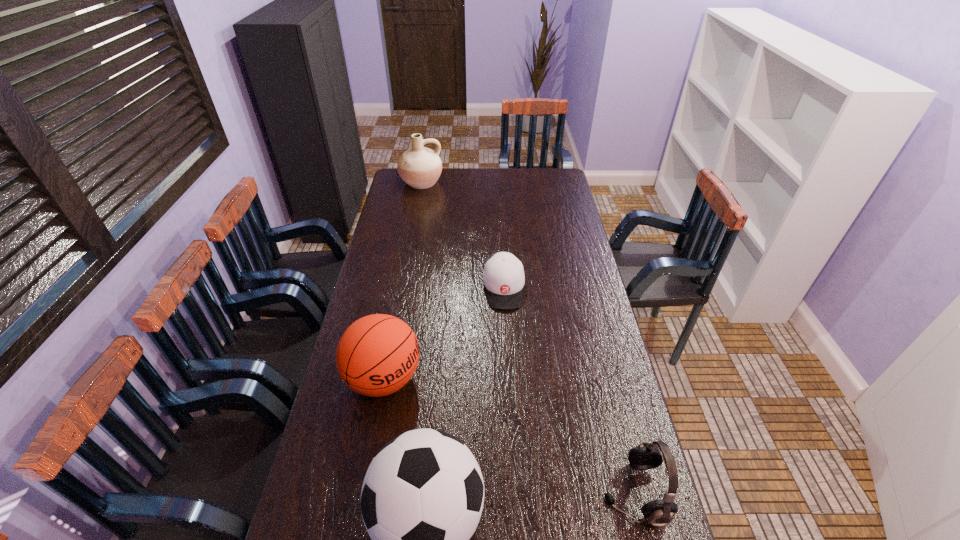
At what (x,y) coordinates should I click in order to perform the action: click on vacant space located 0.320m on the side with logo of the basketball. Please return your answer as a coordinate pair (x, y). The width and height of the screenshot is (960, 540). Looking at the image, I should click on (499, 458).

Find the location of a particular element. vacant region located 0.360m on the side with logo of the basketball is located at coordinates (511, 467).

Locate an element on the screen. free space located 0.350m to pour from the handle of the pottery is located at coordinates (440, 232).

At what (x,y) coordinates should I click in order to perform the action: click on free spot located 0.230m to pour from the handle of the pottery. Please return your answer as a coordinate pair (x, y). This screenshot has height=540, width=960. Looking at the image, I should click on (435, 218).

Identify the location of vacant space situated to pour from the handle of the pottery. The image size is (960, 540). (433, 213).

Identify the location of vacant space situated 0.230m on the front-facing side of the shortest object. (509, 362).

You are a GUI agent. You are given a task and a screenshot of the screen. Output one action in this format:
    pyautogui.click(x=<x>, y=<y>)
    Task: Click on the free space located 0.350m on the front-facing side of the shortest object
    
    Given the screenshot: What is the action you would take?
    pos(511,393)

Where is `free region located 0.310m on the front-facing side of the shortest object`? free region located 0.310m on the front-facing side of the shortest object is located at coordinates (510, 382).

This screenshot has height=540, width=960. In order to click on object situated at the far edge in this screenshot , I will do pos(420,167).

Locate an element on the screen. This screenshot has width=960, height=540. object present at the near edge is located at coordinates (646, 456).